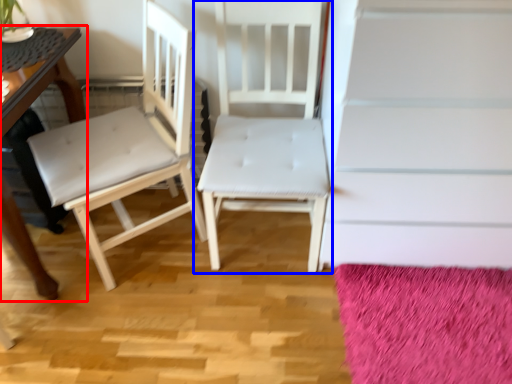
Question: Which point is closer to the camera, table (highlighted by a red box) or chair (highlighted by a blue box)?

Choices:
 (A) table
 (B) chair

Answer: (A)